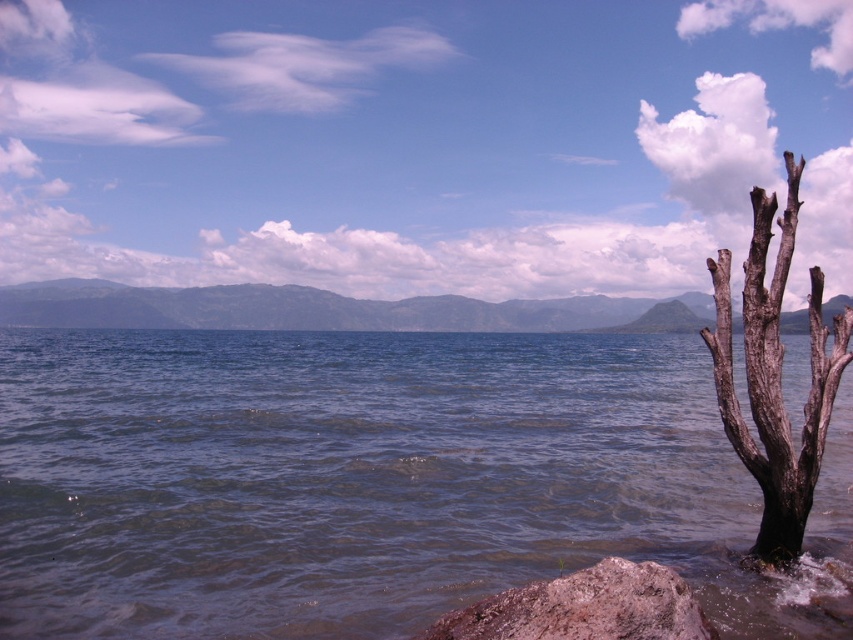
You are a kayaker who wants to paddle from the clear water at lower left to the dark brown bark tree at right. Given that your kayak can only handle calm waters up to 50 meters in distance, will you be able to reach the tree without encountering rough waters?

The clear water at lower left is 47.15 meters from the dark brown bark tree at right. Since the distance is within the kayak can handle calm waters up to 50 meters, you can reach the tree without encountering rough waters.

You are standing at the point marked by point (376, 481). What type of terrain are you currently on?

The point (376, 481) is clear water at lower left, so you are standing on clear water.

You are a kayaker planning to paddle from the clear water at lower left to the dark brown bark tree at right. Considering their widths, which path would allow your kayak to navigate more easily?

The clear water at lower left has a greater width than the dark brown bark tree at right, so navigating the kayak through the clear water at lower left would be easier due to its wider space.